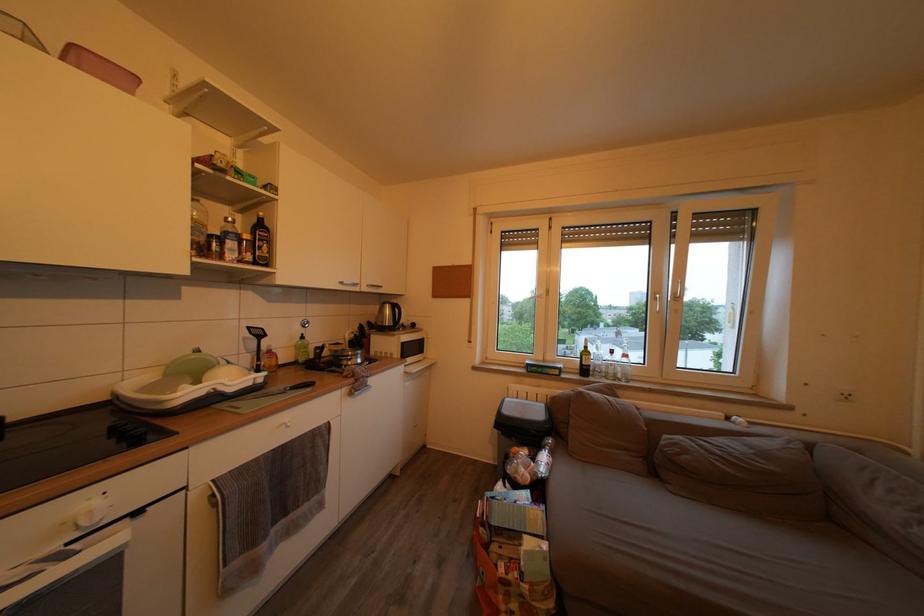
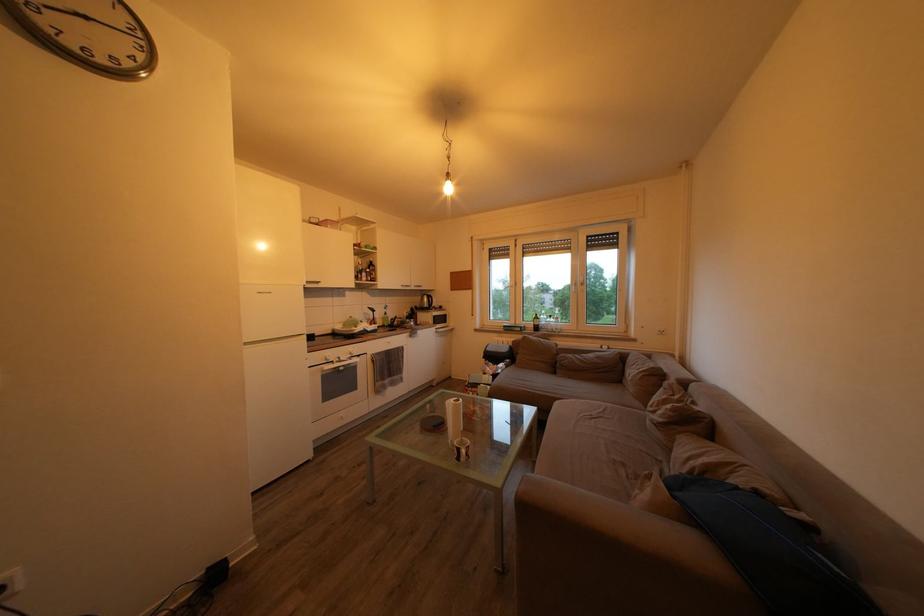
Where in the second image is the point corresponding to pixel 268 341 from the first image?

(381, 317)